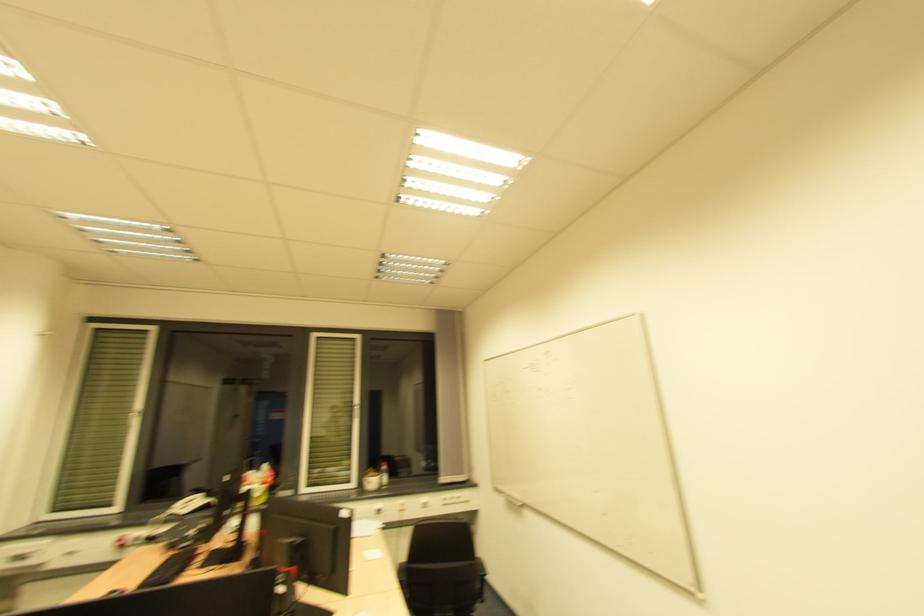
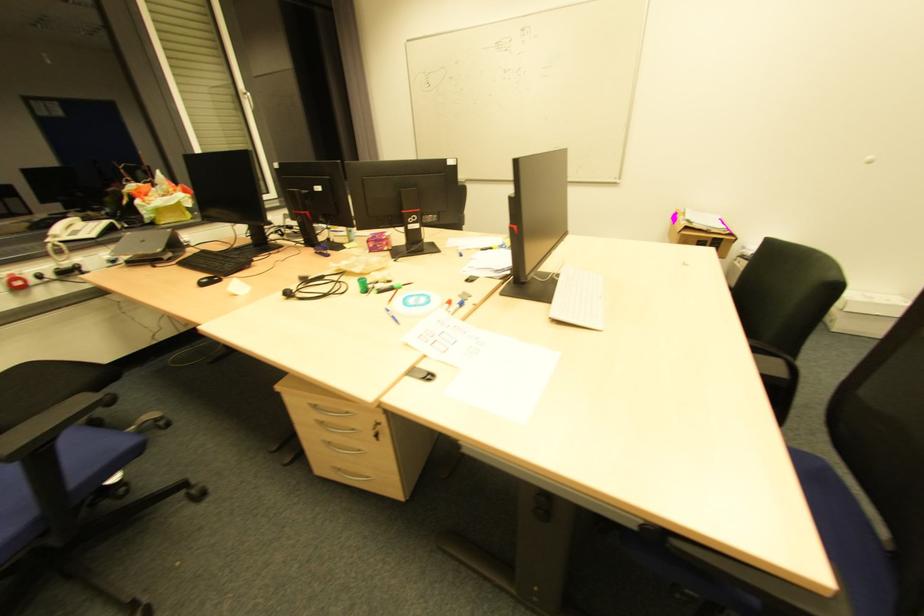
Find the pixel in the second image that matches the point at 119,548 in the first image.

(17, 290)